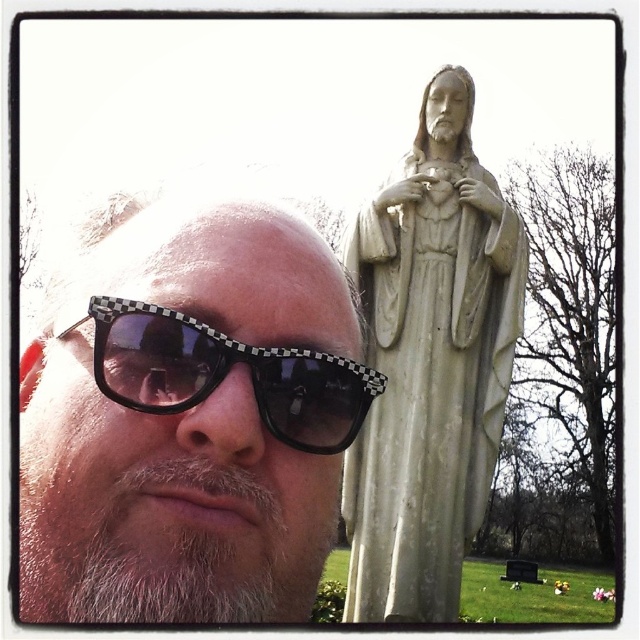
You are a photographer trying to capture the white stone statue at center without any obstructions. The white matte sunglasses at left are in your way. Can you estimate if the statue will be fully visible if you move your camera slightly to the right?

The white matte sunglasses at left might be wider than the white stone statue at center, so moving the camera to the right might not fully reveal the statue if the sunglasses are wider. You may need to adjust your position further or angle the camera differently to ensure the statue is fully visible without obstruction.

You are a photographer trying to capture the white stone statue at center without the white matte sunglasses at left blocking the view. Based on their positions, can you adjust your camera angle to avoid the sunglasses?

The white matte sunglasses at left is located above the white stone statue at center, so you can lower your camera angle to capture the statue below the sunglasses.

You are an optometrist examining two pairs of sunglasses in the image. The first pair is the white matte sunglasses at left, and the second is the black checkered sunglasses at center. Which pair has a wider frame?

The white matte sunglasses at left has a larger width than the black checkered sunglasses at center according to the description, so the white matte sunglasses at left has a wider frame.